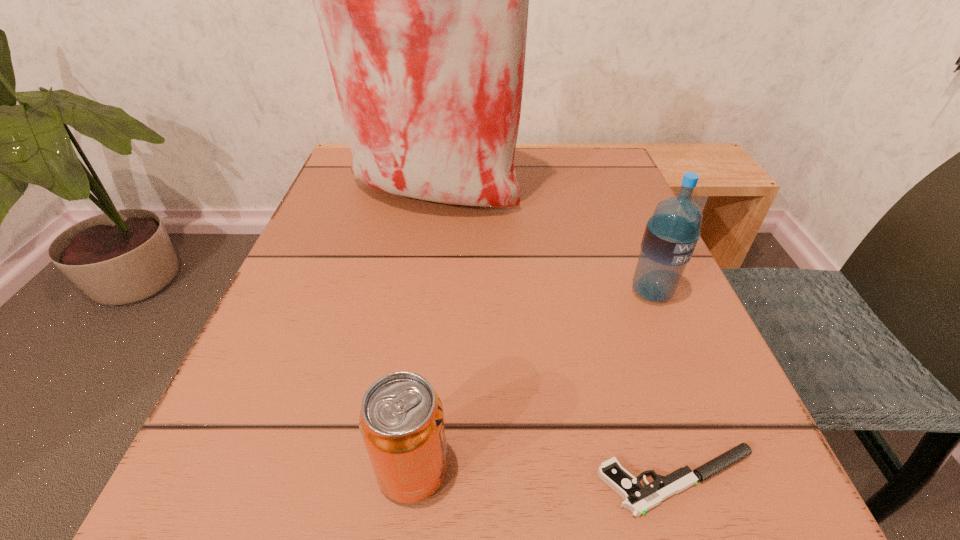
Find the location of `the farthest object`. the farthest object is located at coordinates (422, 0).

Where is `the tallest object`? This screenshot has width=960, height=540. the tallest object is located at coordinates (422, 0).

Identify the location of water bottle. (671, 234).

Find the location of `the third shortest object`. the third shortest object is located at coordinates pyautogui.click(x=671, y=234).

This screenshot has width=960, height=540. I want to click on soda can, so click(x=401, y=421).

Identify the location of pistol. Image resolution: width=960 pixels, height=540 pixels. (638, 499).

Find the location of `vacant space located on the front of the tallest object`. vacant space located on the front of the tallest object is located at coordinates (415, 288).

Where is `free space located on the back of the water bottle`? Image resolution: width=960 pixels, height=540 pixels. free space located on the back of the water bottle is located at coordinates (603, 176).

At what (x,y) coordinates should I click in order to perform the action: click on free space located 0.340m on the right of the second shortest object. Please return your answer as a coordinate pair (x, y). This screenshot has width=960, height=540. Looking at the image, I should click on (760, 469).

At what (x,y) coordinates should I click in order to perform the action: click on vacant space located 0.280m on the front-facing side of the shortest object. Please return your answer as a coordinate pair (x, y). The image size is (960, 540). Looking at the image, I should click on (337, 481).